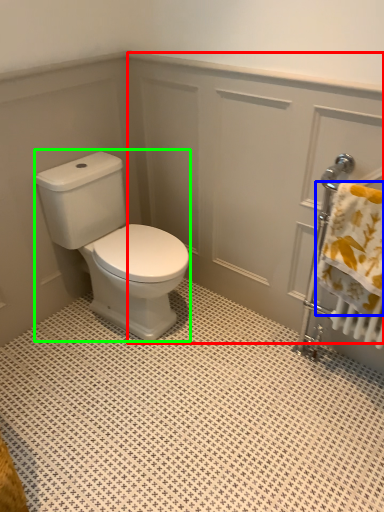
Question: Which object is the farthest from screen door (highlighted by a red box)? Choose among these: bath towel (highlighted by a blue box) or porcelain (highlighted by a green box).

Choices:
 (A) bath towel
 (B) porcelain

Answer: (A)